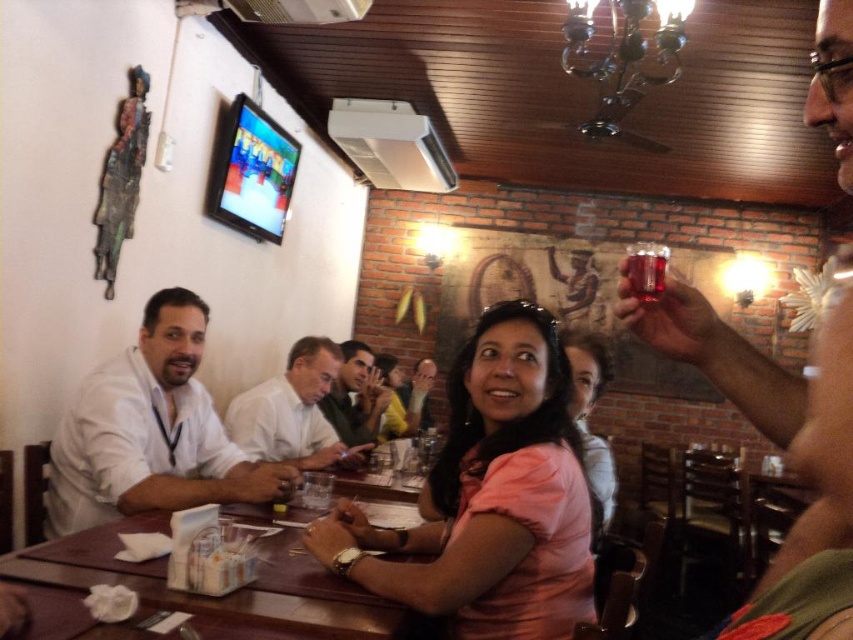
You are a photographer positioned at the entrance of the restaurant. You want to take a photo that includes both the white matte shirt at left and the smooth white shirt at center. Which shirt should you adjust to ensure both are visible in the frame?

You should move the smooth white shirt at center slightly forward because the white matte shirt at left is currently blocking it. By adjusting the smooth white shirt at center to be in front of the white matte shirt at left, both shirts will be visible in the photo.

You are a photographer setting up a shoot in this restaurant. You need to choose between two shirts displayed in the scene for a photoshoot. The shirts are the white matte shirt at left and the smooth white shirt at center. Based on their sizes, which shirt would be more suitable for a model who prefers wearing larger clothing?

The white matte shirt at left is much taller than the smooth white shirt at center, so it would be more suitable for a model who prefers wearing larger clothing.